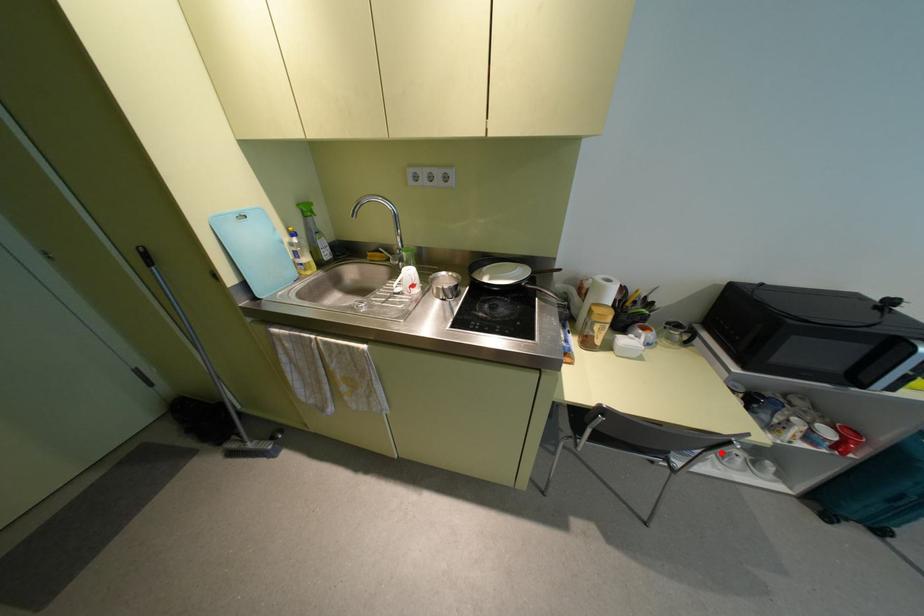
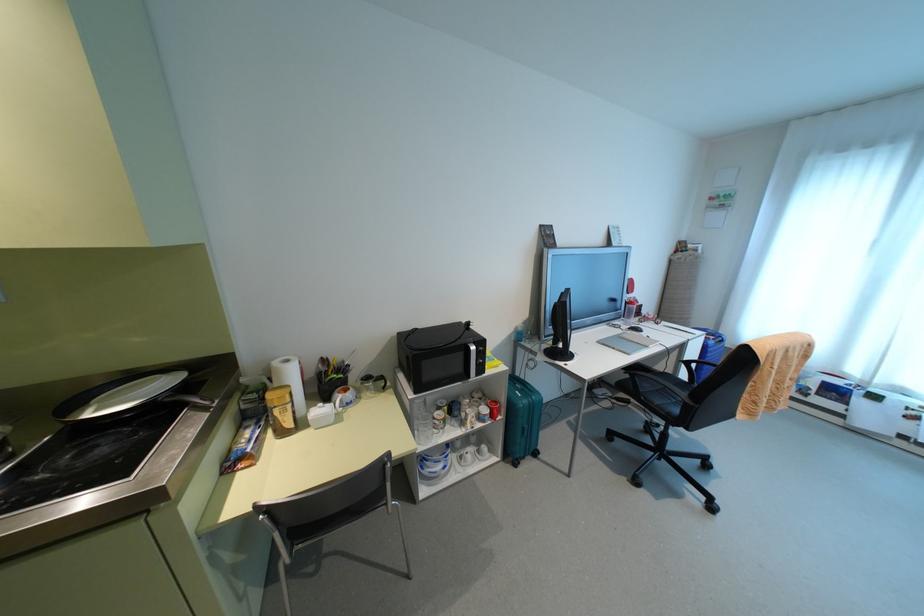
Question: A red point is marked in image1. In image2, is the corresponding 3D point closer to the camera or farther? Reply with the corresponding letter.

Choices:
 (A) The corresponding 3D point is closer.
 (B) The corresponding 3D point is farther.

Answer: (A)